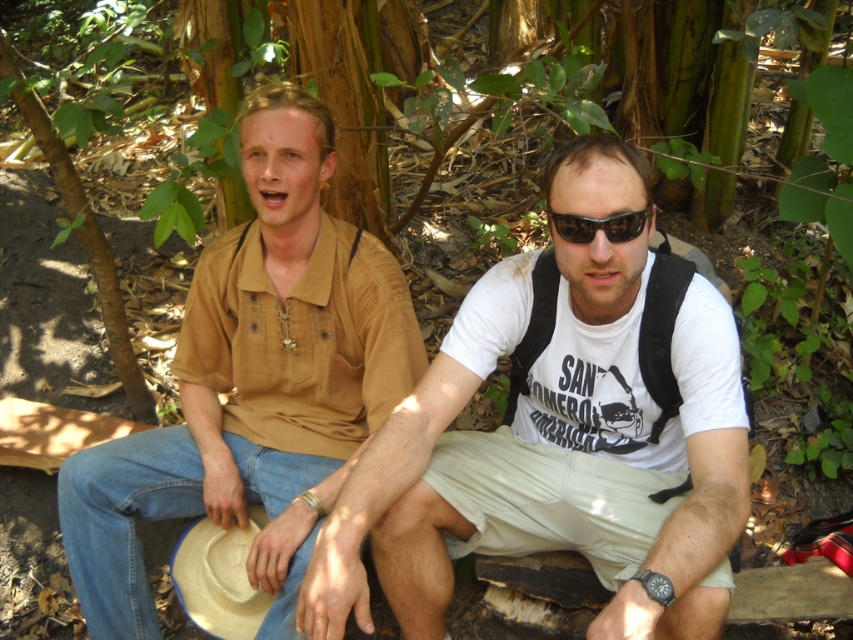
Can you confirm if matte brown shirt at left is thinner than black plastic sunglasses at center?

No, matte brown shirt at left is not thinner than black plastic sunglasses at center.

Measure the distance between point (x=248, y=148) and camera.

They are 6.06 feet apart.

The width and height of the screenshot is (853, 640). I want to click on matte brown shirt at left, so click(254, 384).

Between white cotton t-shirt at center and black plastic sunglasses at center, which one is positioned higher?

black plastic sunglasses at center

Which is in front, point (573, 257) or point (607, 228)?

Point (607, 228) is more forward.

At what (x,y) coordinates should I click in order to perform the action: click on white cotton t-shirt at center. Please return your answer as a coordinate pair (x, y). The width and height of the screenshot is (853, 640). Looking at the image, I should click on coord(556,438).

Is white cotton t-shirt at center bigger than matte brown shirt at left?

Actually, white cotton t-shirt at center might be smaller than matte brown shirt at left.

Which is behind, point (677, 637) or point (352, 330)?

Point (352, 330)

At what (x,y) coordinates should I click in order to perform the action: click on white cotton t-shirt at center. Please return your answer as a coordinate pair (x, y). The height and width of the screenshot is (640, 853). Looking at the image, I should click on (556, 438).